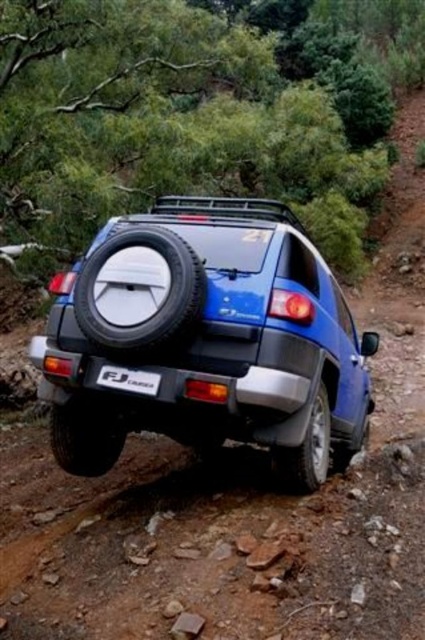
You are a hiker who needs to cross a muddy path. You see the blue matte suv at center and the black rubber tire at lower right. Which object is closer to your current position?

The black rubber tire at lower right is closer to your current position because the blue matte suv at center is positioned on the right side of it.

Consider the image. You are a photographer trying to capture the blue matte suv at center and the black plastic license plate at center in a single shot. Based on their positions, which object will appear larger in the photo?

The blue matte suv at center will appear larger in the photo because it is closer to the viewer than the black plastic license plate at center.

Based on the photo, you are a delivery person needing to fit both the blue matte suv at center and the black rubber tire at lower right into a storage area that is 2 meters wide. Can both items fit side by side without overlapping?

The blue matte suv at center is wider than the black rubber tire at lower right. Since the total width of both items combined would exceed 2 meters, they cannot fit side by side without overlapping in the storage area.